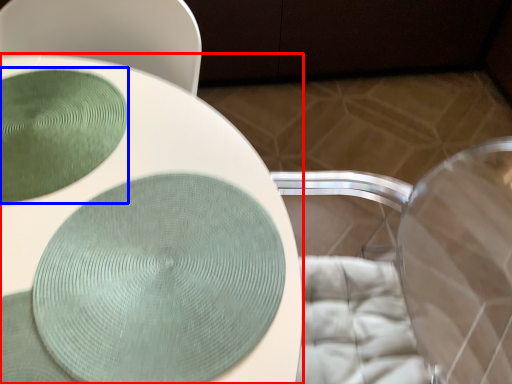
Question: Among these objects, which one is nearest to the camera, toilet (highlighted by a red box) or glass plate (highlighted by a blue box)?

Choices:
 (A) toilet
 (B) glass plate

Answer: (A)